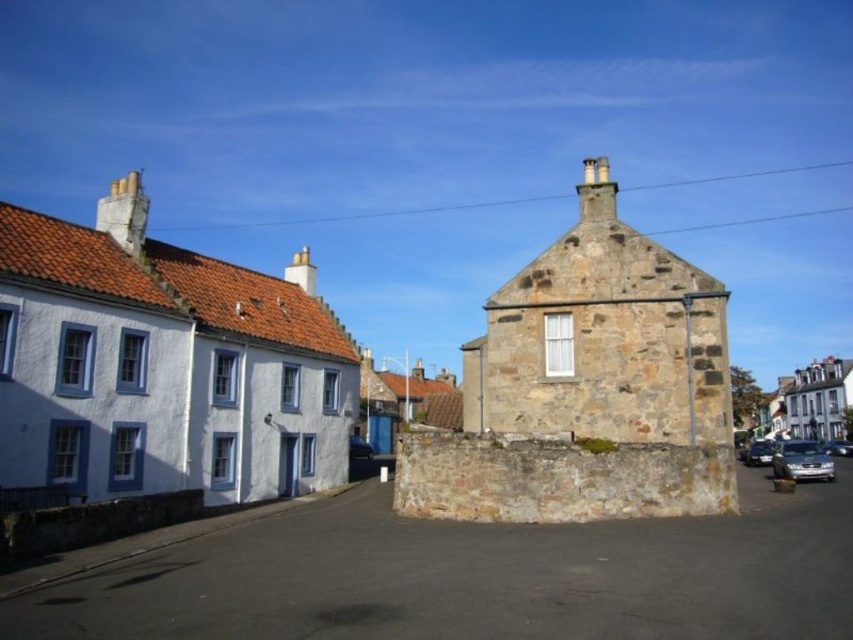
Question: Considering the relative positions of brown stone chimney at upper left and metallic silver car at center in the image provided, where is brown stone chimney at upper left located with respect to metallic silver car at center?

Choices:
 (A) left
 (B) right

Answer: (A)

Question: Based on their relative distances, which object is nearer to the satin silver sedan at lower right?

Choices:
 (A) smooth stone chimney at center
 (B) stone chimney at upper center
 (C) metallic silver car at center

Answer: (B)

Question: Considering the real-world distances, which object is farthest from the stone chimney at upper center?

Choices:
 (A) metallic silver car at lower right
 (B) shiny silver car at lower right

Answer: (A)

Question: Can you confirm if satin silver sedan at lower right is smaller than metallic silver car at lower right?

Choices:
 (A) yes
 (B) no

Answer: (B)

Question: Is satin silver sedan at lower right behind shiny silver car at lower right?

Choices:
 (A) no
 (B) yes

Answer: (A)

Question: Estimate the real-world distances between objects in this image. Which object is closer to the smooth stone chimney at center?

Choices:
 (A) shiny silver car at lower right
 (B) stone chimney at upper center

Answer: (B)